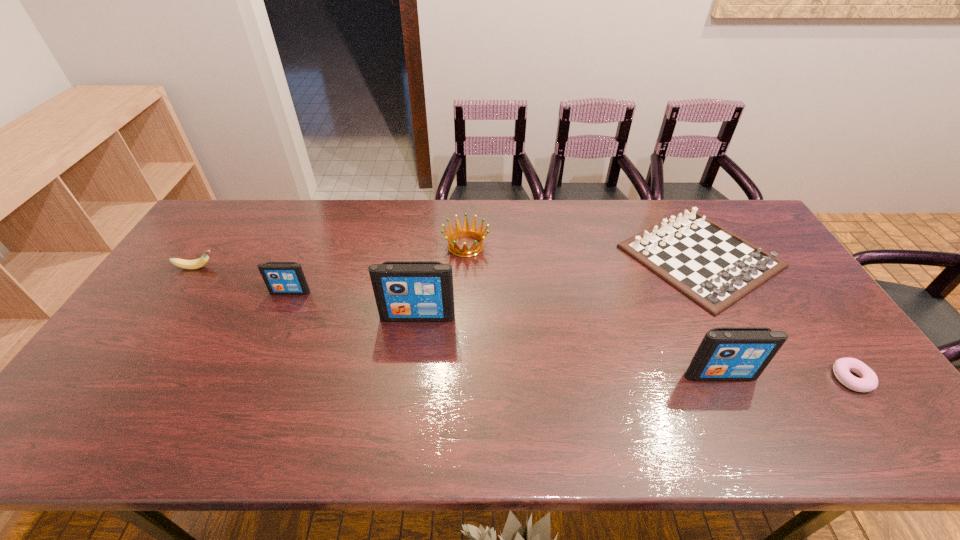
This screenshot has height=540, width=960. In order to click on the second object from left to right in this screenshot , I will do point(281,278).

This screenshot has width=960, height=540. Find the location of `the leftmost iPod`. the leftmost iPod is located at coordinates (281, 278).

Find the location of a particular element. the second farthest iPod is located at coordinates (405, 291).

This screenshot has height=540, width=960. Identify the location of the rightmost iPod. (726, 353).

Where is `the second tallest iPod`? This screenshot has height=540, width=960. the second tallest iPod is located at coordinates (726, 353).

At what (x,y) coordinates should I click in order to perform the action: click on chessboard. Please return your answer as a coordinate pair (x, y). This screenshot has width=960, height=540. Looking at the image, I should click on (712, 266).

Where is `crown`? The image size is (960, 540). crown is located at coordinates (465, 231).

Identify the location of banana. This screenshot has width=960, height=540. (197, 263).

I want to click on pastry, so click(x=868, y=381).

At what (x,y) coordinates should I click in order to perform the action: click on vacant region located on the front screen of the sixth object from right to left. Please return your answer as a coordinate pair (x, y). The height and width of the screenshot is (540, 960). Looking at the image, I should click on (280, 315).